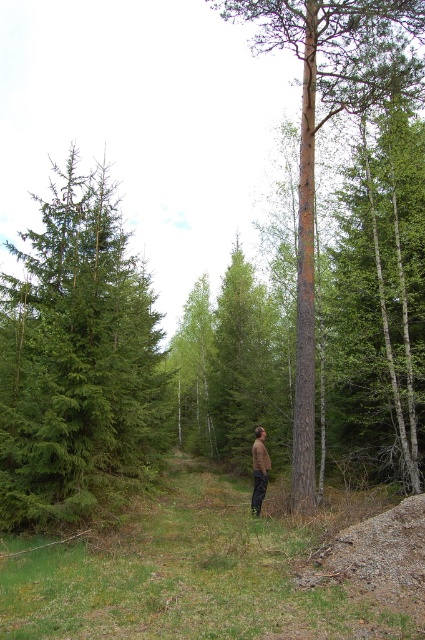
Does point (48, 432) come behind point (251, 508)?

No, it is in front of (251, 508).

Is green needle-like tree at left closer to the viewer compared to brown fabric pants at center?

That is True.

The height and width of the screenshot is (640, 425). What do you see at coordinates (79, 362) in the screenshot?
I see `green needle-like tree at left` at bounding box center [79, 362].

I want to click on green needle-like tree at left, so 79,362.

Between green needle-like tree at left and brown rough bark tree at center, which one appears on the left side from the viewer's perspective?

green needle-like tree at left is more to the left.

Between point (81, 202) and point (402, 54), which one is positioned behind?

Point (81, 202)

Locate an element on the screen. The height and width of the screenshot is (640, 425). green needle-like tree at left is located at coordinates (79, 362).

Is brown rough bark tree at center wider than brown fabric pants at center?

Indeed, brown rough bark tree at center has a greater width compared to brown fabric pants at center.

Which is in front, point (385, 38) or point (255, 500)?

Positioned in front is point (255, 500).

Locate an element on the screen. brown rough bark tree at center is located at coordinates (320, 125).